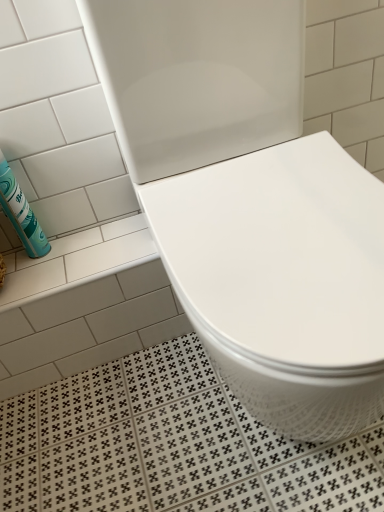
Question: Based on their positions, is white glossy toilet at center located to the left or right of teal matte canister at left?

Choices:
 (A) left
 (B) right

Answer: (B)

Question: Considering the positions of white glossy toilet at center and teal matte canister at left in the image, is white glossy toilet at center bigger or smaller than teal matte canister at left?

Choices:
 (A) big
 (B) small

Answer: (A)

Question: Is white glossy toilet at center spatially inside teal matte canister at left, or outside of it?

Choices:
 (A) outside
 (B) inside

Answer: (A)

Question: Based on their sizes in the image, would you say teal matte canister at left is bigger or smaller than white glossy toilet at center?

Choices:
 (A) small
 (B) big

Answer: (A)

Question: Considering the positions of teal matte canister at left and white glossy toilet at center in the image, is teal matte canister at left taller or shorter than white glossy toilet at center?

Choices:
 (A) short
 (B) tall

Answer: (A)

Question: From a real-world perspective, is teal matte canister at left positioned above or below white glossy toilet at center?

Choices:
 (A) below
 (B) above

Answer: (B)

Question: From the image's perspective, is teal matte canister at left positioned above or below white glossy toilet at center?

Choices:
 (A) below
 (B) above

Answer: (B)